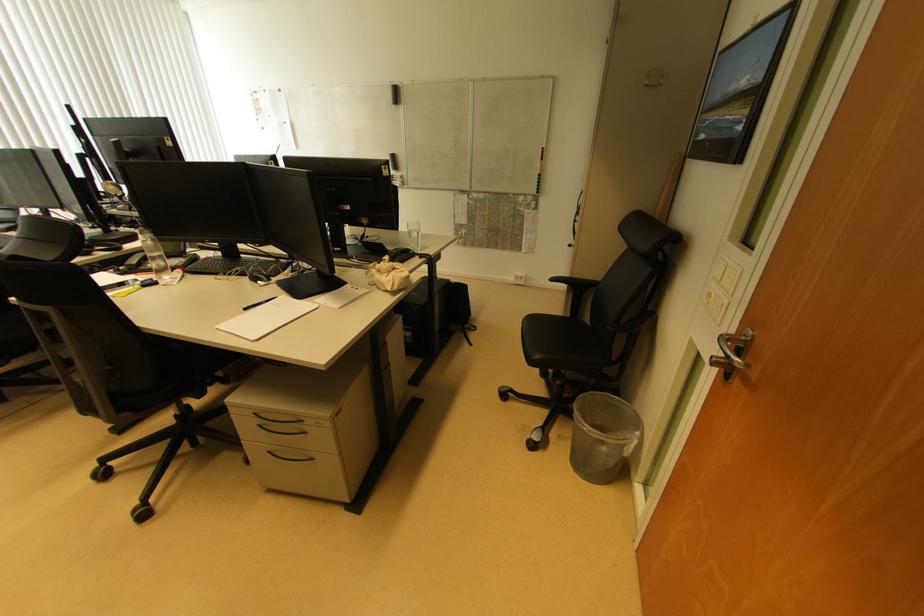
What do you see at coordinates (715, 302) in the screenshot? I see `the white light switch` at bounding box center [715, 302].